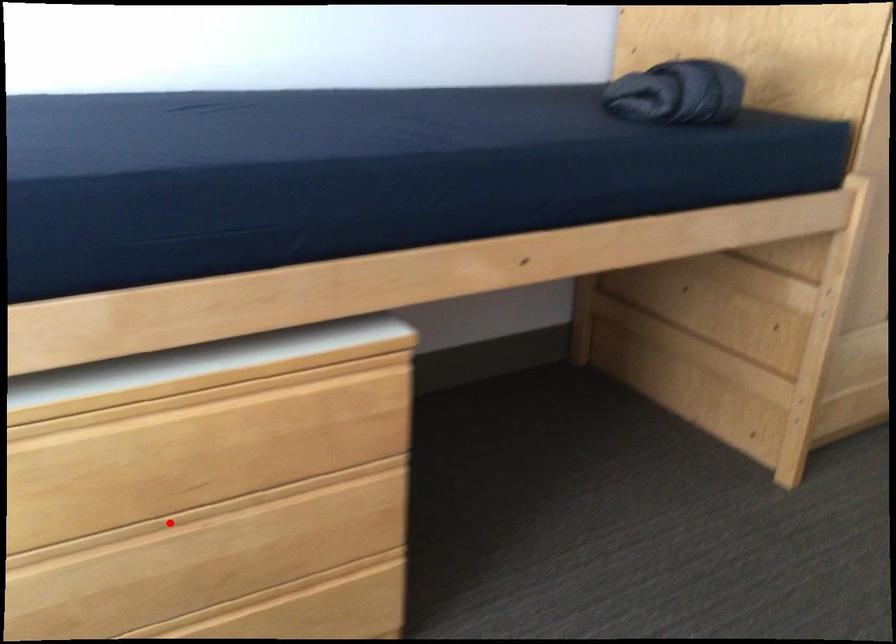
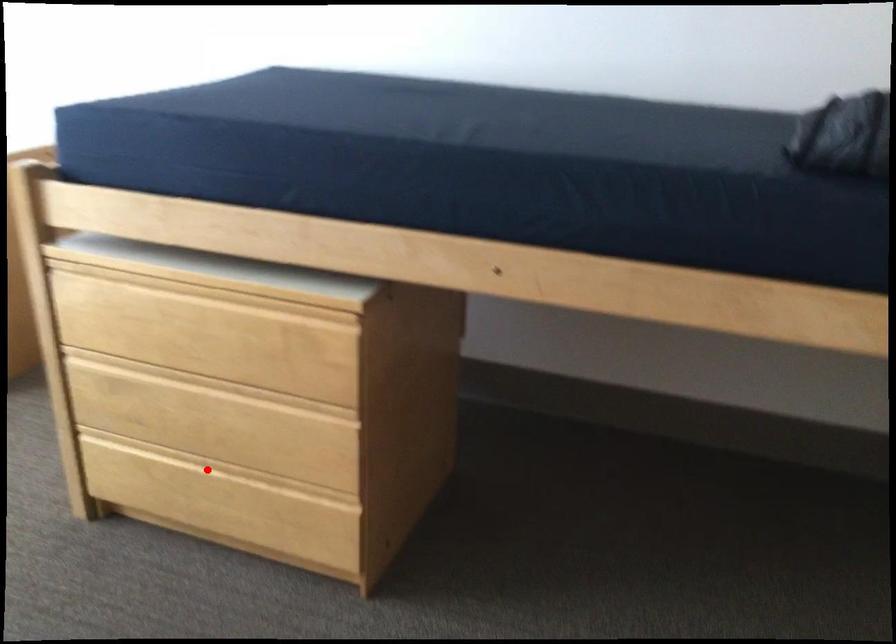
I am providing you with two images of the same scene from different viewpoints. A red point is marked on the first image and another point is marked on the second image. Are the points marked in image1 and image2 representing the same 3D position?

No